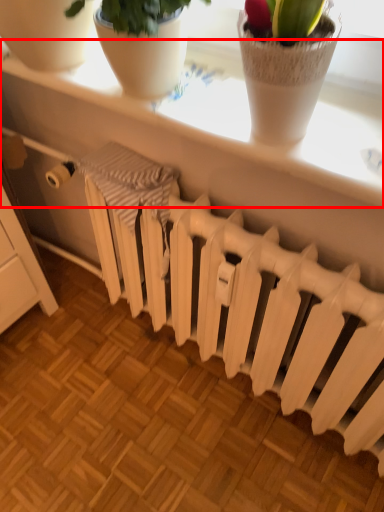
Question: From the image's perspective, what is the correct spatial positioning of window sill (annotated by the red box) in reference to radiator?

Choices:
 (A) above
 (B) below

Answer: (A)